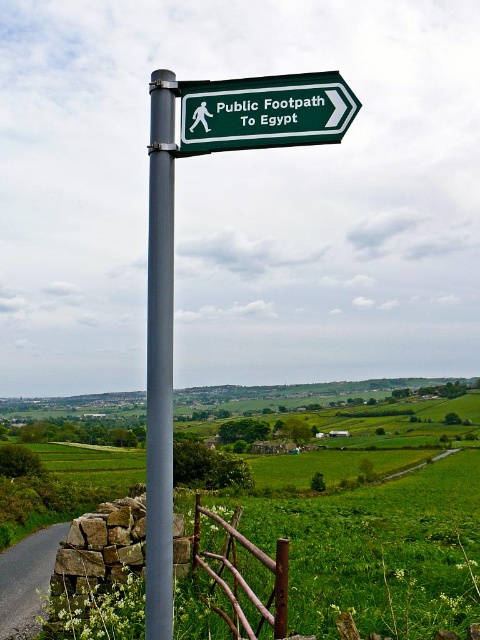
Between gray metallic pole at center and rustic wood fence at lower center, which one has less height?

Standing shorter between the two is rustic wood fence at lower center.

Is gray metallic pole at center closer to camera compared to rustic wood fence at lower center?

That is True.

Does point (146, 456) come behind point (249, 592)?

No, it is in front of (249, 592).

What are the coordinates of `gray metallic pole at center` in the screenshot? It's located at (159, 358).

Consider the image. Who is shorter, green matte signpost at upper center or rustic wood fence at lower center?

green matte signpost at upper center is shorter.

Does green matte signpost at upper center have a smaller size compared to rustic wood fence at lower center?

Correct, green matte signpost at upper center occupies less space than rustic wood fence at lower center.

Which is behind, point (298, 132) or point (215, 609)?

Point (215, 609)

Identify the location of green matte signpost at upper center. The height and width of the screenshot is (640, 480). (264, 113).

Does point (168, 493) come farther from viewer compared to point (232, 118)?

That is False.

This screenshot has width=480, height=640. What are the coordinates of `gray metallic pole at center` in the screenshot? It's located at (159, 358).